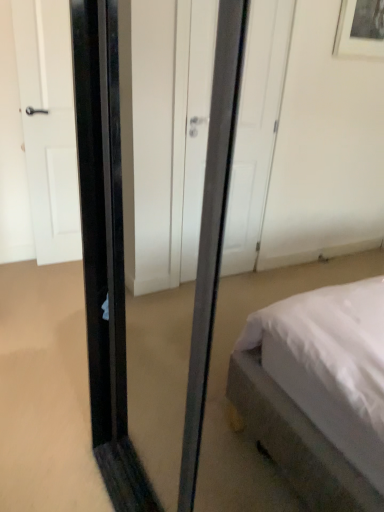
Locate an element on the screen. This screenshot has height=512, width=384. white matte door at left is located at coordinates (49, 126).

This screenshot has height=512, width=384. What do you see at coordinates (49, 126) in the screenshot?
I see `white matte door at left` at bounding box center [49, 126].

At what (x,y) coordinates should I click in order to perform the action: click on white matte door at left. Please return your answer as a coordinate pair (x, y). The image size is (384, 512). Looking at the image, I should click on (49, 126).